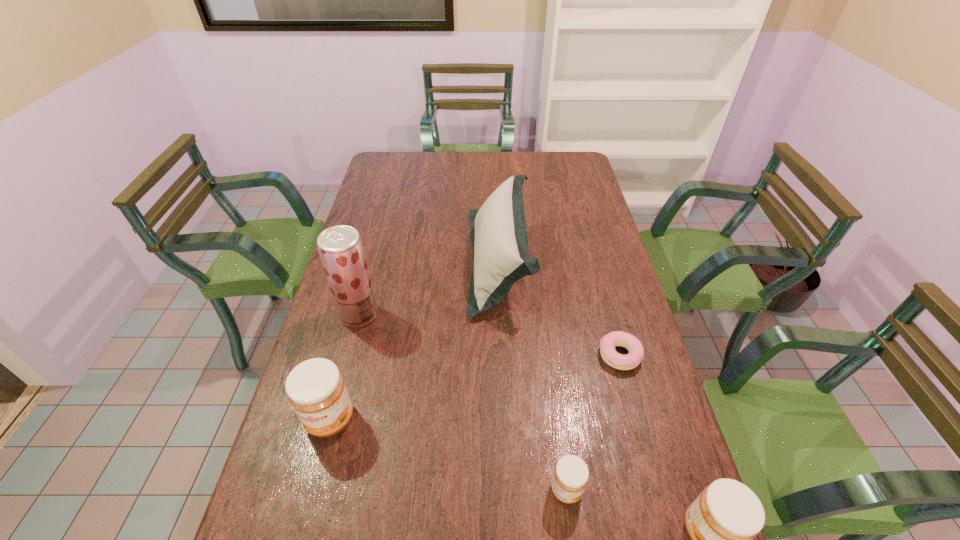
Where is `jam that is the third nearest to the tallest object`? jam that is the third nearest to the tallest object is located at coordinates (723, 521).

In order to click on jam that is the closest to the third nearest object in this screenshot , I will do `click(570, 477)`.

At what (x,y) coordinates should I click in order to perform the action: click on vacant space that satisfies the following two spatial constraints: 1. on the front side of the shortest object; 2. on the front label of the second jam from left to right. Please return your answer as a coordinate pair (x, y). The height and width of the screenshot is (540, 960). Looking at the image, I should click on (657, 490).

This screenshot has width=960, height=540. In order to click on vacant region that satisfies the following two spatial constraints: 1. on the surface of the fifth shortest object; 2. on the right side of the shortest object in this screenshot , I will do `click(503, 355)`.